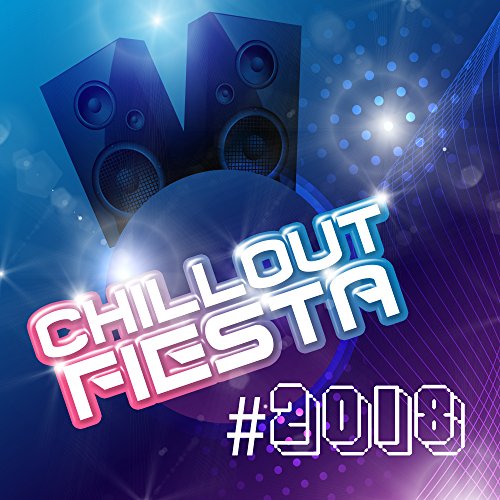
This screenshot has height=500, width=500. Identify the location of disco ball. (381, 126).